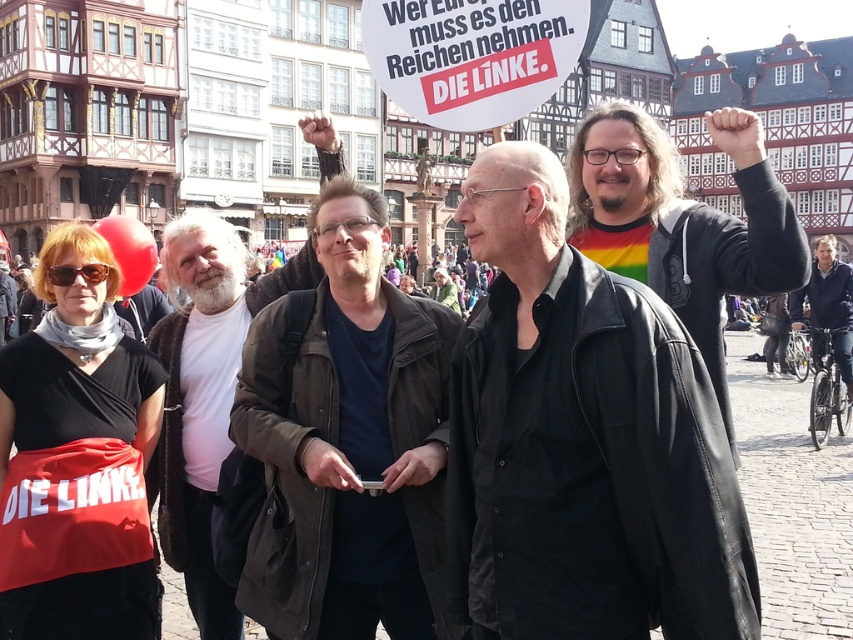
Is point (415, 456) farther from viewer compared to point (318, 145)?

No, (415, 456) is in front of (318, 145).

Is point (383, 394) farther from camera compared to point (289, 289)?

No, it is not.

Where is `dark brown leather jacket at center`? dark brown leather jacket at center is located at coordinates (349, 442).

Which is more to the right, dark brown leather jacket at center or rainbow striped shirt at right?

From the viewer's perspective, rainbow striped shirt at right appears more on the right side.

Identify the location of dark brown leather jacket at center. This screenshot has height=640, width=853. (349, 442).

Is point (299, 449) less distant than point (683, 301)?

Yes, it is in front of point (683, 301).

You are a GUI agent. You are given a task and a screenshot of the screen. Output one action in this format:
    pyautogui.click(x=<x>, y=<y>)
    Task: Click on the dark brown leather jacket at center
    Image resolution: width=853 pixels, height=640 pixels.
    Given the screenshot: What is the action you would take?
    [349, 442]

In the scene shown: How distant is black leather jacket at center from white t-shirt at center?

black leather jacket at center is 43.54 feet from white t-shirt at center.

Can you confirm if black leather jacket at center is thinner than white t-shirt at center?

Correct, black leather jacket at center's width is less than white t-shirt at center's.

Is point (643, 468) in front of point (233, 628)?

Yes, it is.

Find the location of a particular element. This screenshot has height=640, width=853. black leather jacket at center is located at coordinates (582, 440).